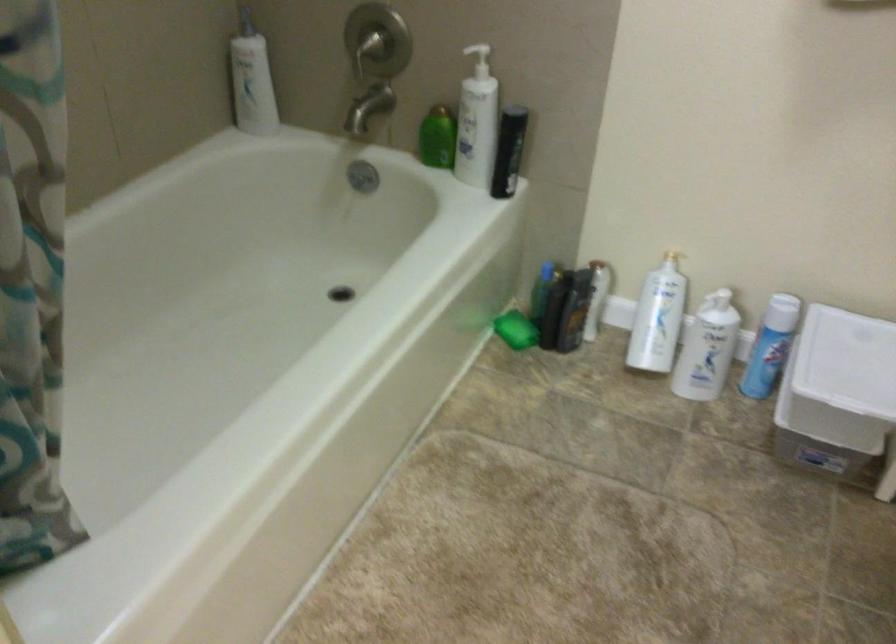
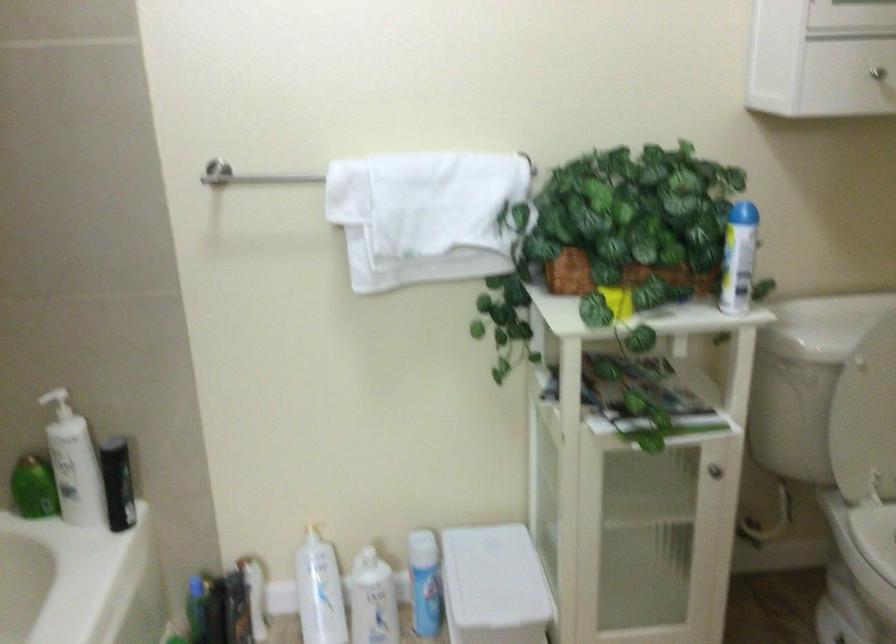
Locate, in the second image, the point that corresponds to point (769, 346) in the first image.

(424, 583)